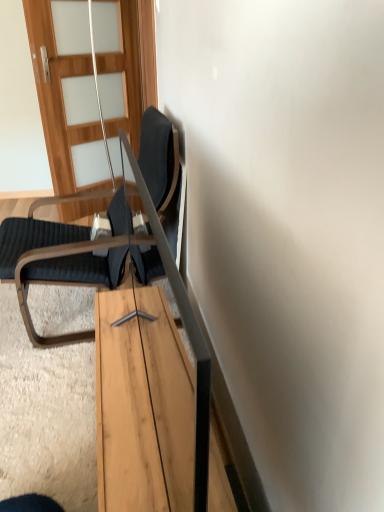
The image size is (384, 512). I want to click on free location above light wood table at center (from a real-world perspective), so click(x=118, y=374).